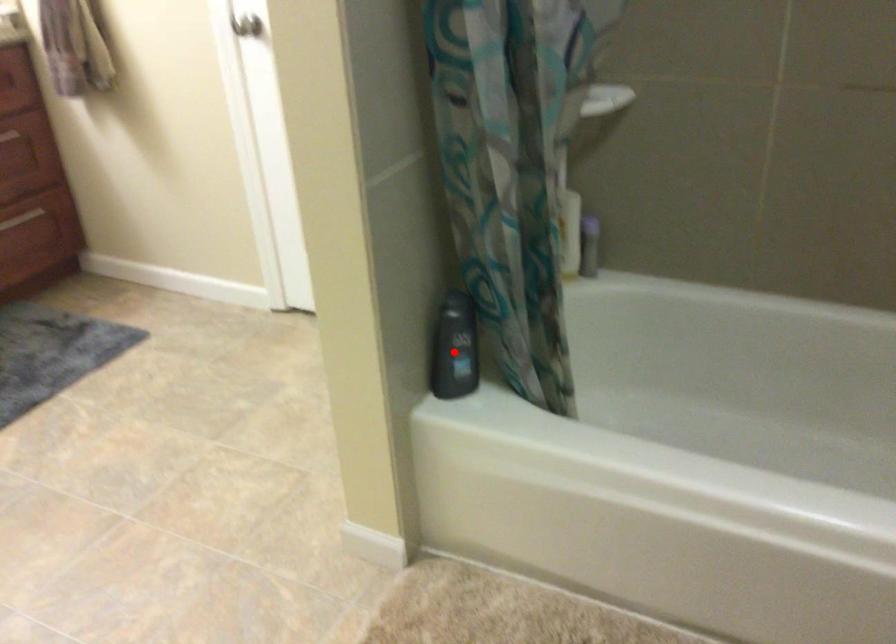
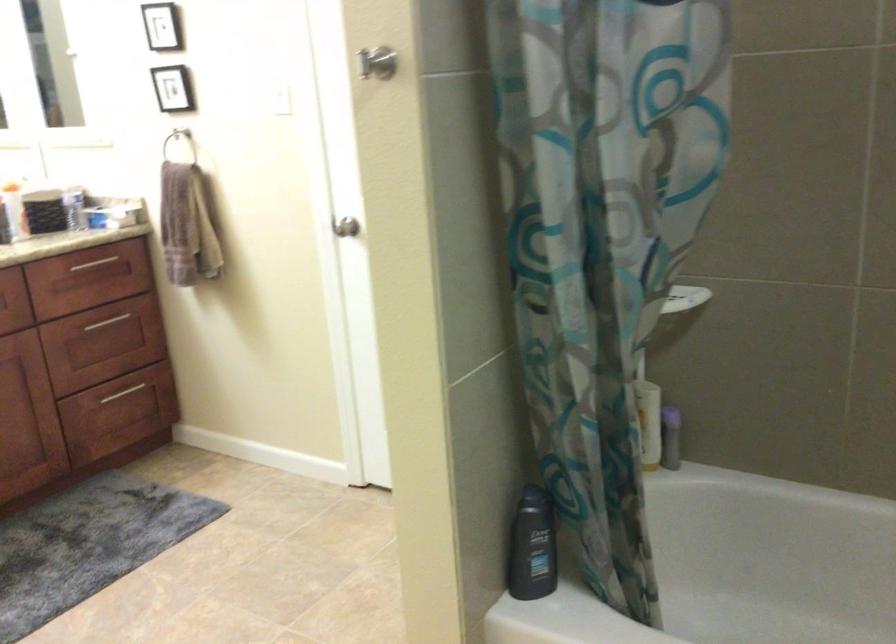
Where in the second image is the point corresponding to the highlighted location from the first image?

(531, 547)